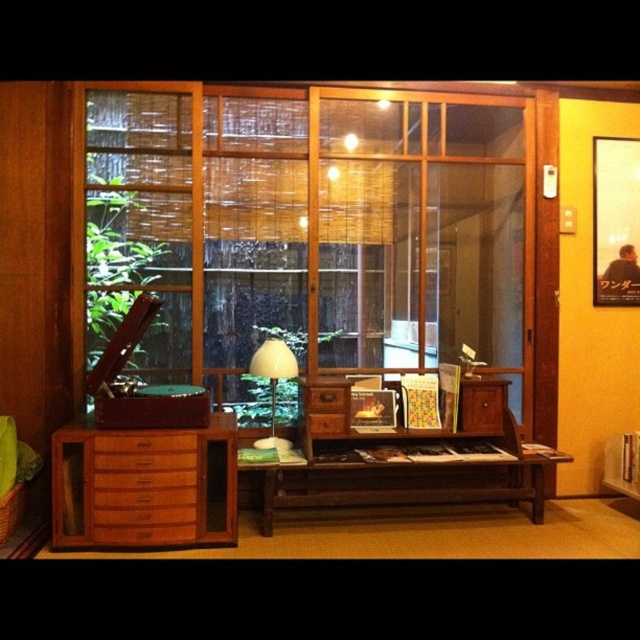
Question: Can you confirm if wooden drawer at left is smaller than brown wood drawer at center?

Choices:
 (A) no
 (B) yes

Answer: (A)

Question: Which object is farther from the camera taking this photo?

Choices:
 (A) wooden drawer at left
 (B) brown wood drawer at left
 (C) wooden drawer at center
 (D) wooden frame at center

Answer: (D)

Question: Which object appears farthest from the camera in this image?

Choices:
 (A) brown wood drawer at left
 (B) white matte lamp at center

Answer: (B)

Question: Can you confirm if wooden cabinet at left is smaller than wooden drawer at left?

Choices:
 (A) yes
 (B) no

Answer: (B)

Question: Based on their relative distances, which object is farther from the wooden drawer at center?

Choices:
 (A) wooden frame at center
 (B) wooden cabinet at left

Answer: (A)

Question: Can you confirm if wooden table at center is bigger than brown wood drawer at center?

Choices:
 (A) no
 (B) yes

Answer: (B)